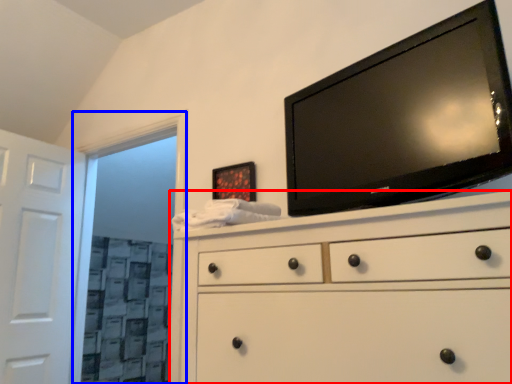
Question: Which object is further to the camera taking this photo, chest of drawers (highlighted by a red box) or glass door (highlighted by a blue box)?

Choices:
 (A) chest of drawers
 (B) glass door

Answer: (B)